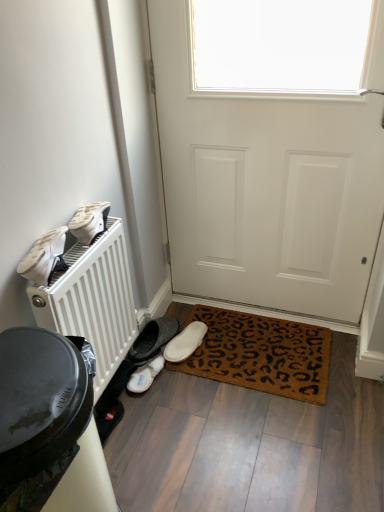
The image size is (384, 512). In order to click on empty space that is ontop of white suede slipper at lower center, placed as the 4th footwear when sorted from front to back (from a real-world perspective) in this screenshot , I will do (188, 335).